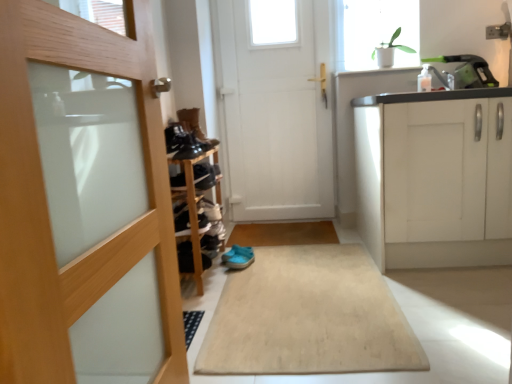
Where is `shiny black shoe at center, the 3th shoe when ordered from bottom to top`? shiny black shoe at center, the 3th shoe when ordered from bottom to top is located at coordinates (205, 174).

What do you see at coordinates (195, 127) in the screenshot?
I see `leather boots at center, which is the 1th shoe from top to bottom` at bounding box center [195, 127].

In order to face black suede shoe at center, which ranks as the fifth shoe in back-to-front order, should I rotate leftwards or rightwards?

To align with it, rotate left about 9.453°.

Where is `light blue fabric slipper at center`? light blue fabric slipper at center is located at coordinates (238, 257).

Describe the element at coordinates (238, 257) in the screenshot. I see `light blue fabric slipper at center` at that location.

This screenshot has height=384, width=512. Find the location of `white matte door at center, which is counted as the 1th door, starting from the right`. white matte door at center, which is counted as the 1th door, starting from the right is located at coordinates (277, 107).

Identify the location of shiny black shoe at center, which appears as the second shoe when viewed from the back. This screenshot has height=384, width=512. (205, 174).

Is white matte door at center, acting as the 2th door starting from the front, in front of or behind shiny black shoes at center, the 2th shoe in the top-to-bottom sequence, in the image?

white matte door at center, acting as the 2th door starting from the front, is positioned farther from the viewer than shiny black shoes at center, the 2th shoe in the top-to-bottom sequence.

From the picture: Is white matte door at center, which is counted as the 1th door, starting from the right, oriented towards shiny black shoes at center, the 2th shoe in the top-to-bottom sequence?

Yes, white matte door at center, which is counted as the 1th door, starting from the right, is aimed at shiny black shoes at center, the 2th shoe in the top-to-bottom sequence.

Who is bigger, white matte door at center, acting as the 2th door starting from the front, or shiny black shoes at center, which is the fourth shoe from bottom to top?

Bigger between the two is white matte door at center, acting as the 2th door starting from the front.

Does white glossy sink at upper right turn towards beige carpet at center?

→ No.

Looking at this image, what's the angular difference between white glossy sink at upper right and beige carpet at center's facing directions?

88.8 degrees separate the facing orientations of white glossy sink at upper right and beige carpet at center.

Does white glossy sink at upper right lie behind beige carpet at center?

Yes, the depth of white glossy sink at upper right is greater than that of beige carpet at center.

From the image's perspective, between white glossy plant at upper right and beige carpet at center, who is located below?

beige carpet at center.

Does point (362, 33) come closer to viewer compared to point (248, 344)?

No, it is not.

In the scene shown: Is beige carpet at center at the back of white glossy plant at upper right?

That's not correct — white glossy plant at upper right is not looking away from beige carpet at center.

Considering the relative positions of white glossy plant at upper right and beige carpet at center in the image provided, is white glossy plant at upper right to the left or to the right of beige carpet at center?

In the image, white glossy plant at upper right appears on the right side of beige carpet at center.

From a real-world perspective, between black suede shoe at center, which ranks as the fifth shoe in back-to-front order, and shiny black shoe at center, which appears as the second shoe when viewed from the back, who is vertically higher?

shiny black shoe at center, which appears as the second shoe when viewed from the back.

Does black suede shoe at center, marked as the 1th shoe in a front-to-back arrangement, have a greater width compared to shiny black shoe at center, which is the fourth shoe from front to back?

Incorrect, the width of black suede shoe at center, marked as the 1th shoe in a front-to-back arrangement, does not surpass that of shiny black shoe at center, which is the fourth shoe from front to back.

From their relative heights in the image, would you say black suede shoe at center, acting as the fourth shoe starting from the top, is taller or shorter than shiny black shoe at center, which appears as the second shoe when viewed from the back?

Clearly, black suede shoe at center, acting as the fourth shoe starting from the top, is shorter compared to shiny black shoe at center, which appears as the second shoe when viewed from the back.

In the image, is black suede shoe at center, marked as the 1th shoe in a front-to-back arrangement, on the left side or the right side of shiny black shoe at center, marked as the third shoe in a top-to-bottom arrangement?

black suede shoe at center, marked as the 1th shoe in a front-to-back arrangement, is to the right of shiny black shoe at center, marked as the third shoe in a top-to-bottom arrangement.

Considering the positions of point (198, 151) and point (216, 144), is point (198, 151) closer or farther from the camera than point (216, 144)?

Point (198, 151) is positioned closer to the camera compared to point (216, 144).

Consider the image. Would you say shiny black shoes at center, which is the 2th shoe from front to back, is to the left or to the right of leather boots at center, which is counted as the 5th shoe, starting from the bottom, in the picture?

shiny black shoes at center, which is the 2th shoe from front to back, is positioned on leather boots at center, which is counted as the 5th shoe, starting from the bottom,'s left side.

Can you tell me how much shiny black shoes at center, which is the fourth shoe from bottom to top, and leather boots at center, the first shoe from the back, differ in facing direction?

shiny black shoes at center, which is the fourth shoe from bottom to top, and leather boots at center, the first shoe from the back, are facing 12.6 degrees away from each other.

Is white glossy sink at upper right inside beige carpet at center?

No, white glossy sink at upper right is not inside beige carpet at center.

Is the position of beige carpet at center more distant than that of white glossy sink at upper right?

That is False.

Is beige carpet at center far from white glossy sink at upper right?

Absolutely, beige carpet at center is distant from white glossy sink at upper right.

Which of these two, beige carpet at center or white glossy sink at upper right, is wider?

Wider between the two is beige carpet at center.

Is white glossy plant at upper right at the right side of leather boots at center, the first shoe from the back?

Yes, white glossy plant at upper right is to the right of leather boots at center, the first shoe from the back.

Is white glossy plant at upper right not near leather boots at center, which is the 1th shoe from top to bottom?

white glossy plant at upper right is far away from leather boots at center, which is the 1th shoe from top to bottom.

The image size is (512, 384). What are the coordinates of `door above the shiny black shoes at center, which is the fourth shoe from bottom to top (from a real-world perspective)` in the screenshot? It's located at (277, 107).

Image resolution: width=512 pixels, height=384 pixels. Identify the location of sink above the beige carpet at center (from the image's perspective). (465, 72).

When comparing their distances from shiny black shoe at center, which appears as the second shoe when viewed from the back, does black suede shoe at lower left, arranged as the 3th shoe when viewed from the back, or white glossy plant at upper right seem further?

white glossy plant at upper right lies further to shiny black shoe at center, which appears as the second shoe when viewed from the back, than the other object.

Looking at the image, which one is located closer to leather boots at center, the first shoe from the back, wooden door at left, the 1th door when ordered from front to back, or light blue fabric slipper at center?

light blue fabric slipper at center is positioned closer to the anchor leather boots at center, the first shoe from the back.

Looking at the image, which one is located closer to white glossy plant at upper right, light blue fabric slipper at center or shiny black shoe at center, the 3th shoe when ordered from bottom to top?

shiny black shoe at center, the 3th shoe when ordered from bottom to top, is closer to white glossy plant at upper right.

Considering their positions, is wooden door at left, which ranks as the second door in right-to-left order, positioned closer to black suede shoe at center, arranged as the 2th shoe when ordered from the bottom, than white glossy plant at upper right?

Based on the image, wooden door at left, which ranks as the second door in right-to-left order, appears to be nearer to black suede shoe at center, arranged as the 2th shoe when ordered from the bottom.

Looking at the image, which one is located closer to white matte cabinet at right, light blue fabric slipper at center or wooden door at left, acting as the 1th door starting from the left?

light blue fabric slipper at center is positioned closer to the anchor white matte cabinet at right.

Estimate the real-world distances between objects in this image. Which object is closer to black suede shoe at center, arranged as the 2th shoe when ordered from the bottom, wooden door at left, which ranks as the second door in right-to-left order, or white matte cabinet at right?

wooden door at left, which ranks as the second door in right-to-left order, is positioned closer to the anchor black suede shoe at center, arranged as the 2th shoe when ordered from the bottom.

Based on their spatial positions, is white matte cabinet at right or wooden door at left, which ranks as the second door in right-to-left order, closer to black suede shoe at center, which ranks as the fifth shoe in back-to-front order?

The object closer to black suede shoe at center, which ranks as the fifth shoe in back-to-front order, is wooden door at left, which ranks as the second door in right-to-left order.

Considering their positions, is white matte cabinet at right positioned closer to beige carpet at center than white glossy plant at upper right?

white matte cabinet at right is positioned closer to the anchor beige carpet at center.

The image size is (512, 384). In order to click on footwear between wooden door at left, arranged as the 2th door when viewed from the back, and leather boots at center, the first shoe from the back, along the z-axis in this screenshot , I will do `click(238, 257)`.

Where is `cabinetry located between wooden door at left, which ranks as the second door in right-to-left order, and light blue fabric slipper at center in the depth direction`? The image size is (512, 384). cabinetry located between wooden door at left, which ranks as the second door in right-to-left order, and light blue fabric slipper at center in the depth direction is located at coordinates (436, 177).

Identify the location of shoe between black suede shoe at center, arranged as the 2th shoe when ordered from the bottom, and white glossy sink at upper right, in the horizontal direction. This screenshot has width=512, height=384. (185, 257).

Where is `footwear located between beige carpet at center and white matte door at center, acting as the 2th door starting from the front, in the depth direction`? The image size is (512, 384). footwear located between beige carpet at center and white matte door at center, acting as the 2th door starting from the front, in the depth direction is located at coordinates (238, 257).